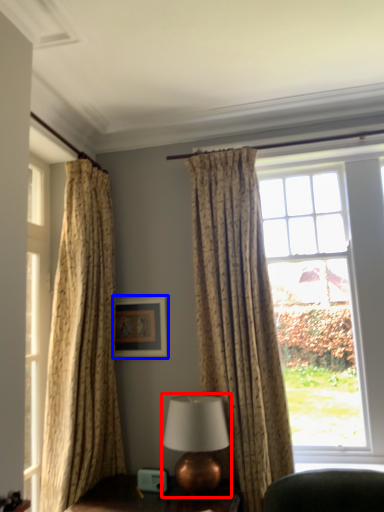
Question: Which object is further to the camera taking this photo, table lamp (highlighted by a red box) or picture frame (highlighted by a blue box)?

Choices:
 (A) table lamp
 (B) picture frame

Answer: (B)